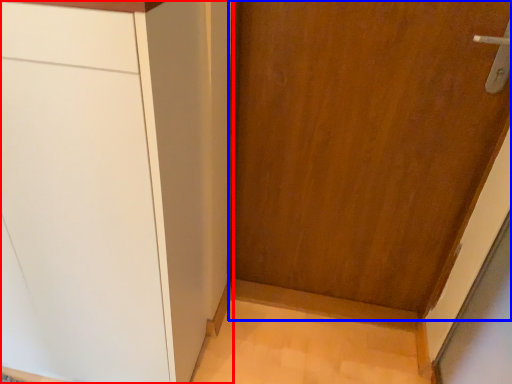
Question: Which of the following is the closest to the observer, cabinetry (highlighted by a red box) or door (highlighted by a blue box)?

Choices:
 (A) cabinetry
 (B) door

Answer: (A)